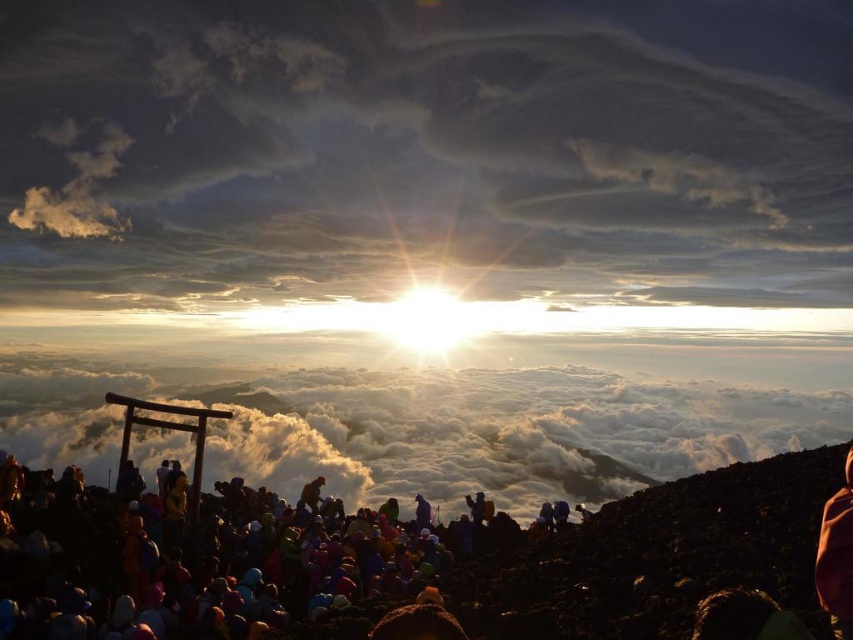
You are a photographer planning to capture the sunrise or sunset at this mountain location. You want to ensure that both the cloudy sky at upper center and the white fluffy cloud at center are visible in your shot. Given that your camera has a fixed focal length, which object should you prioritize framing closer to the center of the photo to include both?

Since the cloudy sky at upper center is larger in size than the white fluffy cloud at center, you should prioritize framing the cloudy sky at upper center closer to the center of the photo to ensure both objects are visible while accommodating their size difference.

You are standing at the base of the mountain and see the multicolored fabric at lower center. According to the coordinates provided, is the fabric located closer to the left or right edge of the image?

The multicolored fabric at lower center is located at point 0.881 on the x axis, which is closer to the right edge of the image.

You are a photographer planning to capture the sunrise or sunset scene at Mount Fuji. You notice the cloudy sky at upper center and the white fluffy cloud at center. Which object is located above the other?

The cloudy sky at upper center is positioned over the white fluffy cloud at center, meaning it is above the cloud.